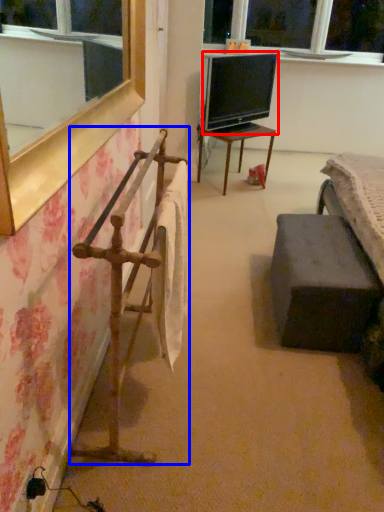
Question: Which of the following is the closest to the observer, television (highlighted by a red box) or rail (highlighted by a blue box)?

Choices:
 (A) television
 (B) rail

Answer: (B)